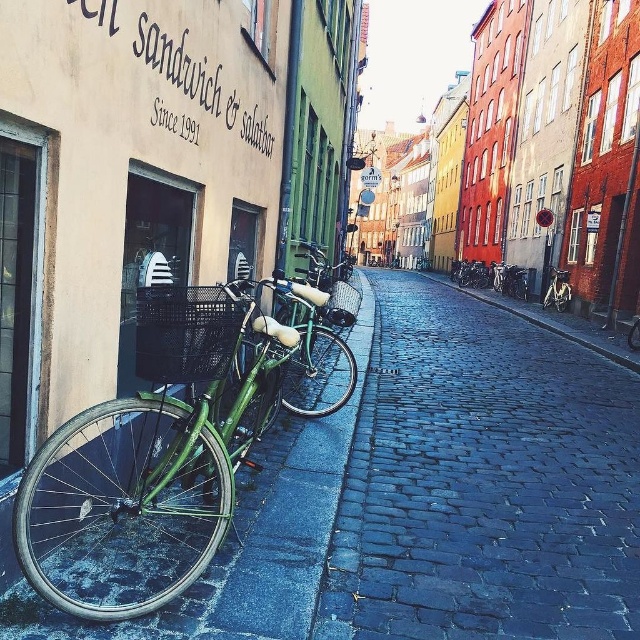
Question: Can you confirm if cobblestone pavement at center is positioned above green matte bicycle at center?

Choices:
 (A) no
 (B) yes

Answer: (A)

Question: Estimate the real-world distances between objects in this image. Which object is farther from the green matte bicycle at center?

Choices:
 (A) green matte bicycle at left
 (B) cobblestone pavement at center

Answer: (A)

Question: Which of the following is the farthest from the observer?

Choices:
 (A) (440, 486)
 (B) (548, 300)

Answer: (B)

Question: Is cobblestone pavement at center positioned in front of green matte bicycle at left?

Choices:
 (A) yes
 (B) no

Answer: (B)

Question: Which of the following is the closest to the observer?

Choices:
 (A) (256, 348)
 (B) (388, 401)

Answer: (A)

Question: Does green matte bicycle at left have a lesser width compared to green matte bicycle at center?

Choices:
 (A) yes
 (B) no

Answer: (B)